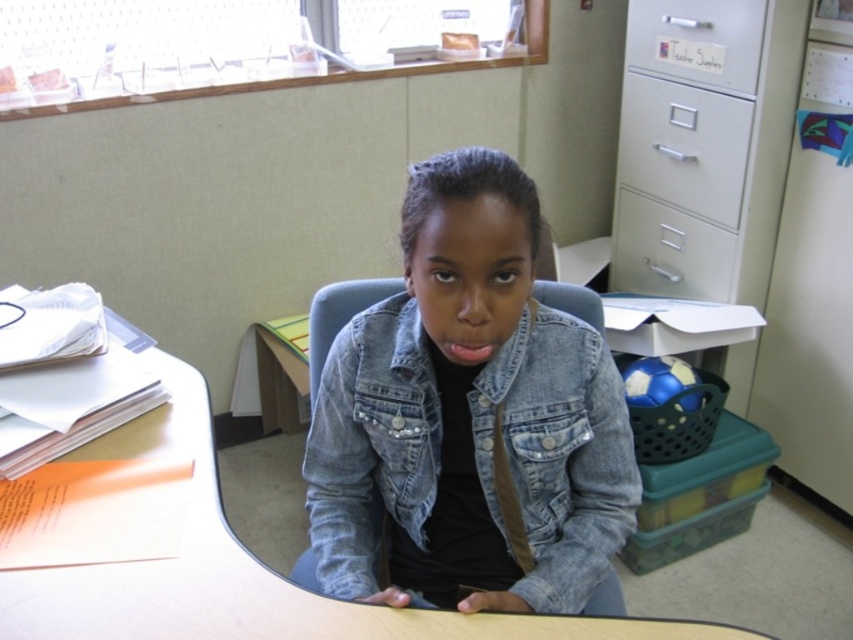
Does white metal file cabinet at upper right have a greater height compared to white plastic drawer at upper right?

Indeed, white metal file cabinet at upper right has a greater height compared to white plastic drawer at upper right.

Is point (625, 240) closer to viewer compared to point (717, 65)?

That is False.

Find the location of a particular element. white metal file cabinet at upper right is located at coordinates (704, 145).

This screenshot has height=640, width=853. Describe the element at coordinates (704, 145) in the screenshot. I see `white metal file cabinet at upper right` at that location.

Which of these two, white metal file cabinet at upper right or smooth wood desk at center, stands taller?

white metal file cabinet at upper right

The image size is (853, 640). Find the location of `white metal file cabinet at upper right`. white metal file cabinet at upper right is located at coordinates (704, 145).

Between white metal file cabinet at upper right and metallic silver drawer at upper right, which one appears on the right side from the viewer's perspective?

Positioned to the right is white metal file cabinet at upper right.

Does white metal file cabinet at upper right have a greater width compared to metallic silver drawer at upper right?

Yes.

Based on the photo, who is more distant from viewer, (776, 22) or (672, 227)?

The point (672, 227) is behind.

Where is `white metal file cabinet at upper right`? This screenshot has width=853, height=640. white metal file cabinet at upper right is located at coordinates (704, 145).